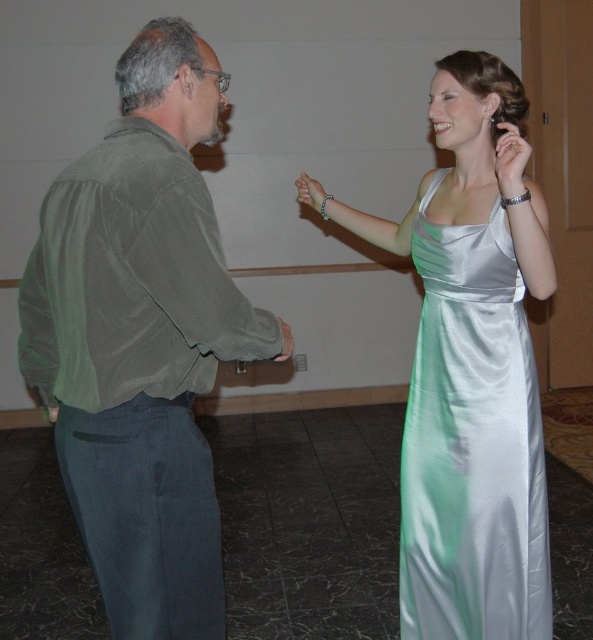
Based on the scene description, which object has a larger size between the green satin shirt at left and the silky silver dress at right?

The green satin shirt at left has a larger size compared to the silky silver dress at right according to the description.